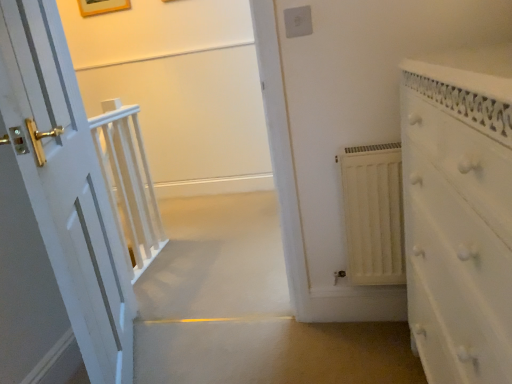
Question: Is white textured dresser at right not inside white matte radiator at center right?

Choices:
 (A) no
 (B) yes

Answer: (B)

Question: From the image's perspective, is white textured dresser at right located beneath white matte radiator at center right?

Choices:
 (A) no
 (B) yes

Answer: (B)

Question: Does white textured dresser at right have a lesser height compared to white matte radiator at center right?

Choices:
 (A) no
 (B) yes

Answer: (A)

Question: Considering the relative sizes of white textured dresser at right and white matte radiator at center right in the image provided, is white textured dresser at right taller than white matte radiator at center right?

Choices:
 (A) no
 (B) yes

Answer: (B)

Question: From a real-world perspective, is white textured dresser at right physically above white matte radiator at center right?

Choices:
 (A) no
 (B) yes

Answer: (B)

Question: From the image's perspective, is white textured dresser at right on white matte radiator at center right?

Choices:
 (A) no
 (B) yes

Answer: (A)

Question: Is white plastic electric outlet at upper center not within wooden picture frame at upper center?

Choices:
 (A) no
 (B) yes

Answer: (B)

Question: Is white plastic electric outlet at upper center positioned with its back to wooden picture frame at upper center?

Choices:
 (A) yes
 (B) no

Answer: (B)

Question: From a real-world perspective, is white plastic electric outlet at upper center below wooden picture frame at upper center?

Choices:
 (A) yes
 (B) no

Answer: (A)

Question: Is the position of white plastic electric outlet at upper center more distant than that of wooden picture frame at upper center?

Choices:
 (A) no
 (B) yes

Answer: (A)

Question: Is white plastic electric outlet at upper center far from wooden picture frame at upper center?

Choices:
 (A) no
 (B) yes

Answer: (B)

Question: Does white plastic electric outlet at upper center have a greater width compared to wooden picture frame at upper center?

Choices:
 (A) yes
 (B) no

Answer: (B)

Question: Considering the relative sizes of white matte radiator at center right and white textured dresser at right in the image provided, is white matte radiator at center right bigger than white textured dresser at right?

Choices:
 (A) no
 (B) yes

Answer: (A)